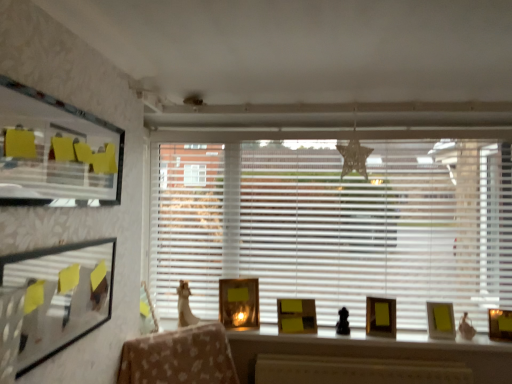
Question: From the image's perspective, does gold metallic picture frame at center, which ranks as the fifth picture frame in right-to-left order, appear higher than matte gold picture frame at right, the first picture frame from the right?

Choices:
 (A) yes
 (B) no

Answer: (A)

Question: Does gold metallic picture frame at center, arranged as the 6th picture frame when viewed from the front, have a lesser height compared to matte gold picture frame at right, the first picture frame from the right?

Choices:
 (A) no
 (B) yes

Answer: (A)

Question: Considering the relative sizes of gold metallic picture frame at center, which is counted as the second picture frame, starting from the left, and matte gold picture frame at right, placed as the 5th picture frame when sorted from back to front, in the image provided, is gold metallic picture frame at center, which is counted as the second picture frame, starting from the left, thinner than matte gold picture frame at right, placed as the 5th picture frame when sorted from back to front,?

Choices:
 (A) no
 (B) yes

Answer: (A)

Question: Considering the relative positions of gold metallic picture frame at center, which is counted as the second picture frame, starting from the left, and matte gold picture frame at right, arranged as the second picture frame when viewed from the front, in the image provided, is gold metallic picture frame at center, which is counted as the second picture frame, starting from the left, to the right of matte gold picture frame at right, arranged as the second picture frame when viewed from the front, from the viewer's perspective?

Choices:
 (A) yes
 (B) no

Answer: (B)

Question: Is gold metallic picture frame at center, arranged as the 1th picture frame when viewed from the back, directly adjacent to matte gold picture frame at right, the first picture frame from the right?

Choices:
 (A) no
 (B) yes

Answer: (A)

Question: Would you say gold metallic picture frame at center, which ranks as the fifth picture frame in right-to-left order, is to the left or to the right of yellow sticky notes at upper left in the picture?

Choices:
 (A) right
 (B) left

Answer: (A)

Question: Considering the positions of point (236, 327) and point (57, 142), is point (236, 327) closer or farther from the camera than point (57, 142)?

Choices:
 (A) closer
 (B) farther

Answer: (B)

Question: Is gold metallic picture frame at center, arranged as the 6th picture frame when viewed from the front, bigger or smaller than yellow sticky notes at upper left?

Choices:
 (A) big
 (B) small

Answer: (B)

Question: Is gold metallic picture frame at center, which ranks as the fifth picture frame in right-to-left order, spatially inside yellow sticky notes at upper left, or outside of it?

Choices:
 (A) outside
 (B) inside

Answer: (A)

Question: Is point (393, 344) closer or farther from the camera than point (315, 324)?

Choices:
 (A) farther
 (B) closer

Answer: (B)

Question: Is wooden desk at center taller or shorter than yellow matte picture frame at center, positioned as the 2th picture frame in back-to-front order?

Choices:
 (A) tall
 (B) short

Answer: (A)

Question: Would you say wooden desk at center is to the left or to the right of yellow matte picture frame at center, marked as the 5th picture frame in a front-to-back arrangement, in the picture?

Choices:
 (A) right
 (B) left

Answer: (B)

Question: From a real-world perspective, is wooden desk at center physically located above or below yellow matte picture frame at center, positioned as the 2th picture frame in back-to-front order?

Choices:
 (A) below
 (B) above

Answer: (A)

Question: Considering the positions of yellow sticky notes at upper left and yellow matte picture frame at center, placed as the 3th picture frame when sorted from left to right, in the image, is yellow sticky notes at upper left wider or thinner than yellow matte picture frame at center, placed as the 3th picture frame when sorted from left to right,?

Choices:
 (A) thin
 (B) wide

Answer: (A)

Question: From a real-world perspective, is yellow sticky notes at upper left above or below yellow matte picture frame at center, positioned as the 2th picture frame in back-to-front order?

Choices:
 (A) below
 (B) above

Answer: (B)